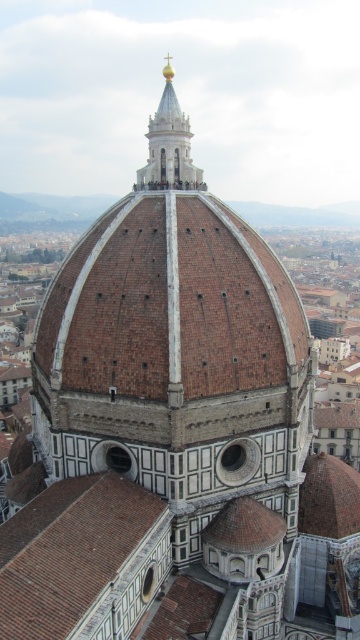
Who is higher up, brown tile roof at lower left or gold polished spire at upper center?

Positioned higher is gold polished spire at upper center.

Is point (10, 634) positioned behind point (150, 116)?

No, it is not.

Describe the element at coordinates (83, 560) in the screenshot. The image size is (360, 640). I see `brown tile roof at lower left` at that location.

Locate an element on the screen. This screenshot has height=640, width=360. brown tile roof at lower left is located at coordinates (83, 560).